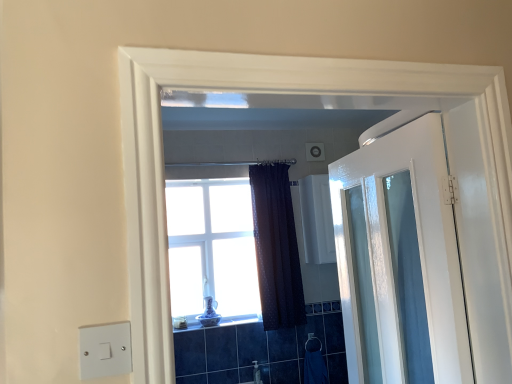
The height and width of the screenshot is (384, 512). What do you see at coordinates (313, 343) in the screenshot?
I see `satin silver towel bar at lower center` at bounding box center [313, 343].

The image size is (512, 384). Identify the location of white glossy medicine cabinet at upper center. (317, 219).

Between satin silver towel bar at lower center and white glass window at center, which one appears on the right side from the viewer's perspective?

satin silver towel bar at lower center is more to the right.

Considering the points (311, 335) and (217, 295), which point is behind, point (311, 335) or point (217, 295)?

The point (217, 295) is more distant.

Which of these two, satin silver towel bar at lower center or white glass window at center, is smaller?

satin silver towel bar at lower center is smaller.

Identify the location of window above the satin silver towel bar at lower center (from a real-world perspective). (212, 248).

Is clear glass window at center at the right side of white plastic light switch at lower left?

Yes, clear glass window at center is to the right of white plastic light switch at lower left.

Is clear glass window at center situated inside white plastic light switch at lower left or outside?

clear glass window at center is located beyond the bounds of white plastic light switch at lower left.

Can you confirm if clear glass window at center is taller than white plastic light switch at lower left?

Correct, clear glass window at center is much taller as white plastic light switch at lower left.

How different are the orientations of clear glass window at center and white plastic light switch at lower left in degrees?

The angular difference between clear glass window at center and white plastic light switch at lower left is 180 degrees.

Can you tell me how much clear glass window at center and white glossy door at right differ in facing direction?

There is a 85.6-degree angle between the facing directions of clear glass window at center and white glossy door at right.

Could you tell me if clear glass window at center is facing white glossy door at right?

Yes, clear glass window at center is aimed at white glossy door at right.

From the image's perspective, who appears lower, clear glass window at center or white glossy door at right?

From the image's view, white glossy door at right is below.

Which object is positioned more to the right, clear glass window at center or white glossy door at right?

white glossy door at right is more to the right.

From the picture: Is white glossy medicine cabinet at upper center to the left or to the right of satin silver towel bar at lower center in the image?

white glossy medicine cabinet at upper center is positioned on satin silver towel bar at lower center's right side.

From a real-world perspective, which is physically below, white glossy medicine cabinet at upper center or satin silver towel bar at lower center?

satin silver towel bar at lower center is physically lower.

Between white glossy medicine cabinet at upper center and satin silver towel bar at lower center, which one is positioned behind?

satin silver towel bar at lower center is more distant.

Does point (309, 236) appear closer or farther from the camera than point (307, 340)?

Clearly, point (309, 236) is more distant from the camera than point (307, 340).

This screenshot has height=384, width=512. In order to click on door that is in front of the blue fabric towel at lower right in this screenshot , I will do `click(400, 260)`.

Considering the relative sizes of white glossy door at right and blue fabric towel at lower right in the image provided, is white glossy door at right taller than blue fabric towel at lower right?

Yes.

Which of these two, white glossy door at right or blue fabric towel at lower right, is thinner?

blue fabric towel at lower right is thinner.

Can you confirm if white plastic light switch at lower left is thinner than blue fabric towel at lower right?

Indeed, white plastic light switch at lower left has a lesser width compared to blue fabric towel at lower right.

Who is smaller, white plastic light switch at lower left or blue fabric towel at lower right?

white plastic light switch at lower left is smaller.

Do you think white plastic light switch at lower left is within blue fabric towel at lower right, or outside of it?

The correct answer is: outside.

Considering the relative positions of white plastic light switch at lower left and blue fabric towel at lower right in the image provided, is white plastic light switch at lower left to the left of blue fabric towel at lower right from the viewer's perspective?

Correct, you'll find white plastic light switch at lower left to the left of blue fabric towel at lower right.

Which is nearer, (323, 220) or (125, 336)?

The point (125, 336) is more forward.

From the image's perspective, which one is positioned lower, white glossy medicine cabinet at upper center or white plastic light switch at lower left?

From the image's view, white plastic light switch at lower left is below.

Is white glossy medicine cabinet at upper center to the right of white plastic light switch at lower left from the viewer's perspective?

Correct, you'll find white glossy medicine cabinet at upper center to the right of white plastic light switch at lower left.

Does white glossy medicine cabinet at upper center come behind white plastic light switch at lower left?

Yes, white glossy medicine cabinet at upper center is further from the camera.

Identify the location of window behind the satin silver towel bar at lower center. (212, 248).

In the image, there is a clear glass window at center. At what (x,y) coordinates should I click in order to perform the action: click on light switch below it (from the image's perspective). Please return your answer as a coordinate pair (x, y). The height and width of the screenshot is (384, 512). Looking at the image, I should click on (105, 350).

From the picture: Estimate the real-world distances between objects in this image. Which object is further from white glossy medicine cabinet at upper center, white glass window at center or blue fabric towel at lower right?

blue fabric towel at lower right is positioned further to the anchor white glossy medicine cabinet at upper center.

From the image, which object appears to be farther from satin silver towel bar at lower center, dark textured curtain at center or white plastic light switch at lower left?

white plastic light switch at lower left lies further to satin silver towel bar at lower center than the other object.

From the image, which object appears to be nearer to dark textured curtain at center, white glossy door at right or white glossy medicine cabinet at upper center?

Based on the image, white glossy medicine cabinet at upper center appears to be nearer to dark textured curtain at center.

When comparing their distances from clear glass window at center, does white plastic light switch at lower left or blue fabric towel at lower right seem closer?

Among the two, white plastic light switch at lower left is located nearer to clear glass window at center.

From the image, which object appears to be farther from white glossy door at right, blue fabric towel at lower right or white plastic light switch at lower left?

blue fabric towel at lower right is further to white glossy door at right.

From the image, which object appears to be nearer to white glossy door at right, white glossy medicine cabinet at upper center or white glass window at center?

Based on the image, white glossy medicine cabinet at upper center appears to be nearer to white glossy door at right.

Based on their spatial positions, is satin silver towel bar at lower center or white glass window at center further from white glossy door at right?

Based on the image, satin silver towel bar at lower center appears to be further to white glossy door at right.

When comparing their distances from white plastic light switch at lower left, does white glossy medicine cabinet at upper center or white glass window at center seem further?

The object further to white plastic light switch at lower left is white glass window at center.

This screenshot has width=512, height=384. Find the location of `curtain positioned between white glossy door at right and white glass window at center from near to far`. curtain positioned between white glossy door at right and white glass window at center from near to far is located at coordinates (276, 247).

Find the location of a particular element. Image resolution: width=512 pixels, height=384 pixels. window frame between white plastic light switch at lower left and blue fabric towel at lower right from front to back is located at coordinates (334, 105).

Locate an element on the screen. The height and width of the screenshot is (384, 512). door between clear glass window at center and white glass window at center in the front-back direction is located at coordinates (400, 260).

This screenshot has height=384, width=512. In order to click on towel bar that lies between white glass window at center and blue fabric towel at lower right from top to bottom in this screenshot , I will do `click(313, 343)`.